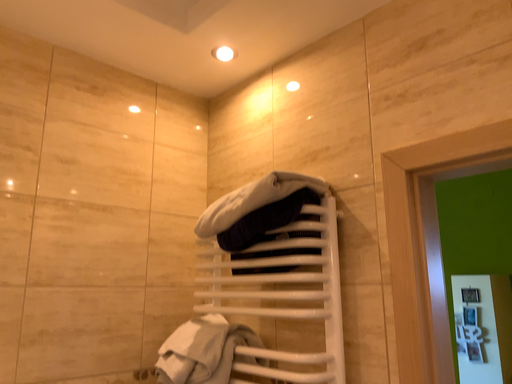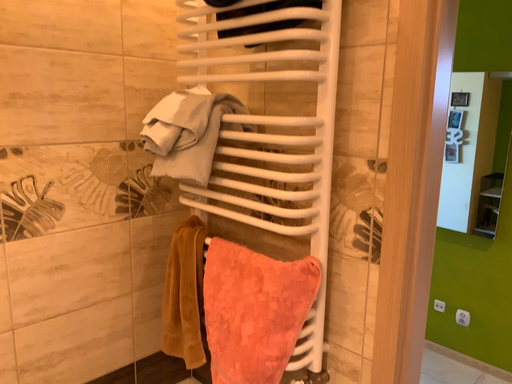
Question: Which way did the camera rotate in the video?

Choices:
 (A) rotated upward
 (B) rotated downward

Answer: (B)